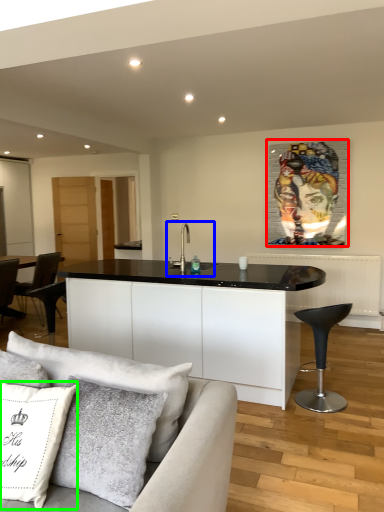
Question: Estimate the real-world distances between objects in this image. Which object is farther from picture frame (highlighted by a red box), sink (highlighted by a blue box) or pillow (highlighted by a green box)?

Choices:
 (A) sink
 (B) pillow

Answer: (B)